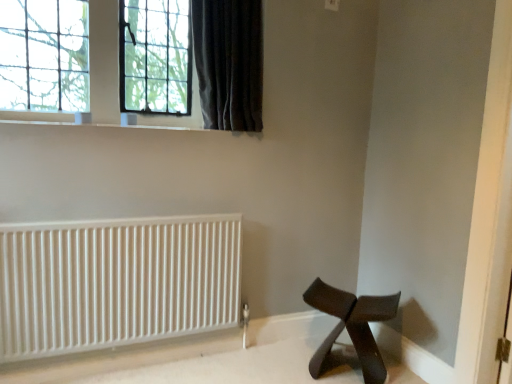
Question: Is clear glass window at upper left at the right side of black matte stool at lower right?

Choices:
 (A) no
 (B) yes

Answer: (A)

Question: Is black matte stool at lower right surrounded by clear glass window at upper left?

Choices:
 (A) yes
 (B) no

Answer: (B)

Question: Is clear glass window at upper left closer to the viewer compared to black matte stool at lower right?

Choices:
 (A) no
 (B) yes

Answer: (A)

Question: Is clear glass window at upper left positioned far away from black matte stool at lower right?

Choices:
 (A) yes
 (B) no

Answer: (A)

Question: Is clear glass window at upper left oriented away from black matte stool at lower right?

Choices:
 (A) yes
 (B) no

Answer: (B)

Question: Choose the correct answer: Is black matte stool at lower right inside white matte radiator at lower left or outside it?

Choices:
 (A) inside
 (B) outside

Answer: (B)

Question: Based on their positions, is black matte stool at lower right located to the left or right of white matte radiator at lower left?

Choices:
 (A) right
 (B) left

Answer: (A)

Question: Is black matte stool at lower right taller or shorter than white matte radiator at lower left?

Choices:
 (A) short
 (B) tall

Answer: (A)

Question: In terms of width, does black matte stool at lower right look wider or thinner when compared to white matte radiator at lower left?

Choices:
 (A) thin
 (B) wide

Answer: (B)

Question: Is dark velvet curtain at upper left spatially inside clear glass window at upper left, or outside of it?

Choices:
 (A) outside
 (B) inside

Answer: (A)

Question: From a real-world perspective, is dark velvet curtain at upper left physically located above or below clear glass window at upper left?

Choices:
 (A) above
 (B) below

Answer: (A)

Question: Considering their positions, is dark velvet curtain at upper left located in front of or behind clear glass window at upper left?

Choices:
 (A) behind
 (B) front

Answer: (B)

Question: Is dark velvet curtain at upper left wider or thinner than clear glass window at upper left?

Choices:
 (A) wide
 (B) thin

Answer: (A)

Question: From the image's perspective, is clear glass window at upper left located above or below black matte stool at lower right?

Choices:
 (A) above
 (B) below

Answer: (A)

Question: Visually, is clear glass window at upper left positioned to the left or to the right of black matte stool at lower right?

Choices:
 (A) right
 (B) left

Answer: (B)